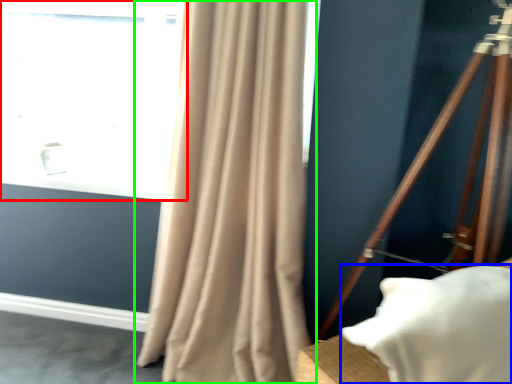
Question: Which is nearer to the window (highlighted by a red box)? pillow (highlighted by a blue box) or curtain (highlighted by a green box).

Choices:
 (A) pillow
 (B) curtain

Answer: (B)